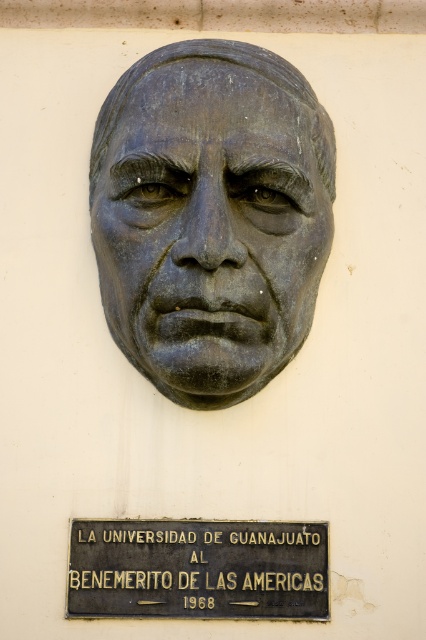
Looking at this image, you are an art conservator standing in front of the wall. You need to place a protective covering over the bronze sculpture at center. Given that the covering must be centered at the same coordinates as the sculpture, what are the coordinates where you should position it?

The bronze sculpture at center is located at point [212,227], so you should position the protective covering at those same coordinates to ensure it is centered.